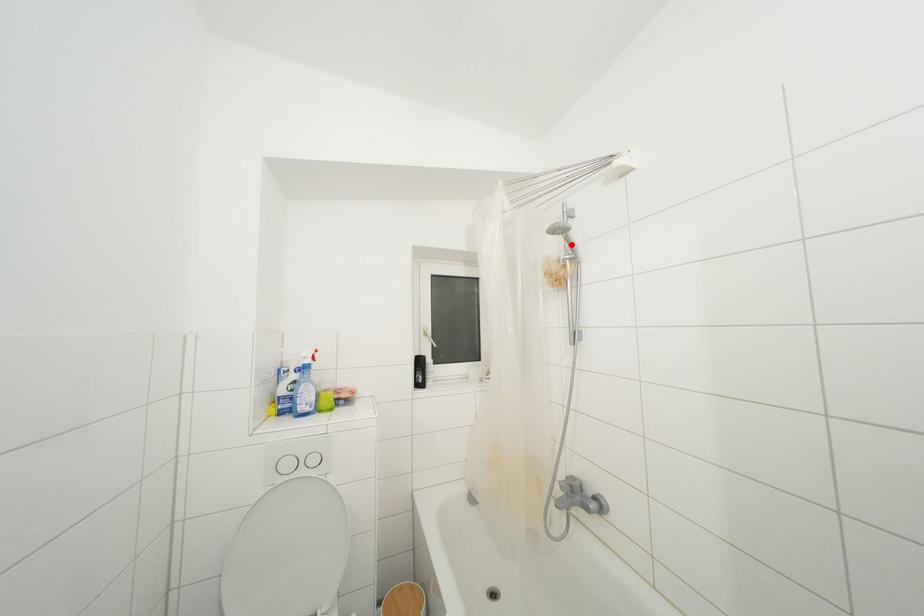
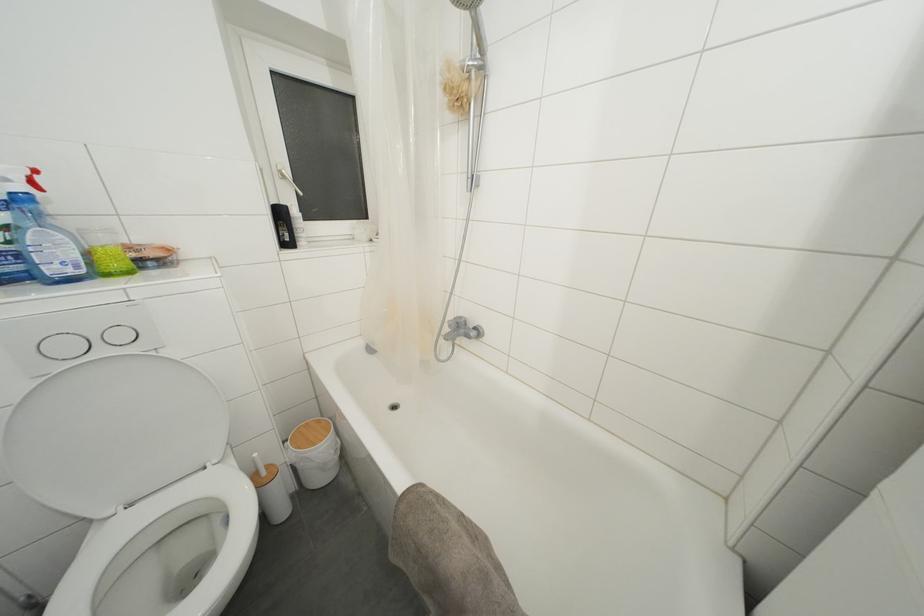
Locate, in the second image, the point that corresponds to the highlighted location in the first image.

(480, 31)